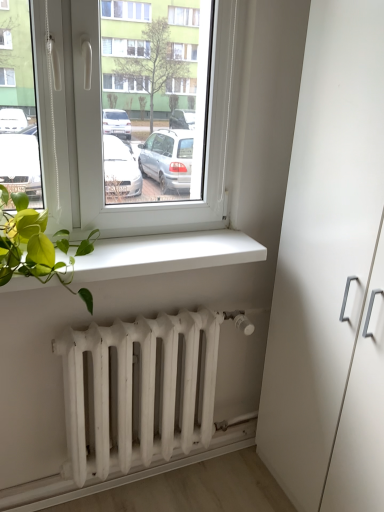
Question: In terms of width, does white matte window sill at lower center look wider or thinner when compared to white matte radiator at lower center?

Choices:
 (A) wide
 (B) thin

Answer: (A)

Question: Does point (261, 248) appear closer or farther from the camera than point (94, 481)?

Choices:
 (A) farther
 (B) closer

Answer: (B)

Question: Estimate the real-world distances between objects in this image. Which object is farther from the white matte radiator at lower center?

Choices:
 (A) white matte radiator at lower center
 (B) white matte cabinet at right
 (C) white matte window sill at lower center

Answer: (B)

Question: Estimate the real-world distances between objects in this image. Which object is closer to the white matte cabinet at right?

Choices:
 (A) white matte window sill at lower center
 (B) white matte radiator at lower center
 (C) white matte radiator at lower center

Answer: (A)